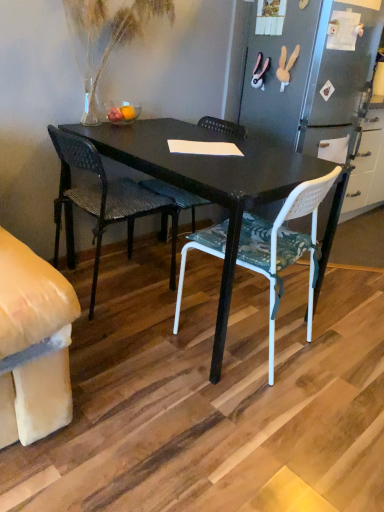
The image size is (384, 512). What do you see at coordinates (285, 246) in the screenshot? I see `white plastic chair at center, placed as the 1th chair when sorted from right to left` at bounding box center [285, 246].

Describe the element at coordinates (105, 200) in the screenshot. Image resolution: width=384 pixels, height=512 pixels. I see `woven dark brown chair at center, which is the second chair in right-to-left order` at that location.

This screenshot has height=512, width=384. I want to click on woven dark brown chair at center, which ranks as the 1th chair in left-to-right order, so click(x=105, y=200).

Locate an element on the screen. The width and height of the screenshot is (384, 512). translucent glass vase at upper left is located at coordinates (106, 36).

Considering the relative positions of woven dark brown chair at center, which is the second chair in right-to-left order, and translucent glass vase at upper left in the image provided, is woven dark brown chair at center, which is the second chair in right-to-left order, to the right of translucent glass vase at upper left from the viewer's perspective?

No, woven dark brown chair at center, which is the second chair in right-to-left order, is not to the right of translucent glass vase at upper left.

Could you tell me if woven dark brown chair at center, which is the second chair in right-to-left order, is facing translucent glass vase at upper left?

No.

Is woven dark brown chair at center, which is the second chair in right-to-left order, with translucent glass vase at upper left?

No, woven dark brown chair at center, which is the second chair in right-to-left order, is not beside translucent glass vase at upper left.

Can you confirm if woven dark brown chair at center, which is the second chair in right-to-left order, is shorter than translucent glass vase at upper left?

No.

Could you tell me if woven dark brown chair at center, which is the second chair in right-to-left order, is turned towards white plastic chair at center, the 2th chair in the left-to-right sequence?

No, woven dark brown chair at center, which is the second chair in right-to-left order, is not facing towards white plastic chair at center, the 2th chair in the left-to-right sequence.

Is woven dark brown chair at center, which is the second chair in right-to-left order, not close to white plastic chair at center, placed as the 1th chair when sorted from right to left?

woven dark brown chair at center, which is the second chair in right-to-left order, is actually quite close to white plastic chair at center, placed as the 1th chair when sorted from right to left.

From a real-world perspective, which is physically above, woven dark brown chair at center, which is the second chair in right-to-left order, or white plastic chair at center, the 2th chair in the left-to-right sequence?

white plastic chair at center, the 2th chair in the left-to-right sequence, is physically above.

Which is more to the left, woven dark brown chair at center, which is the second chair in right-to-left order, or white plastic chair at center, placed as the 1th chair when sorted from right to left?

Positioned to the left is woven dark brown chair at center, which is the second chair in right-to-left order.

Considering the positions of objects translucent glass vase at upper left and woven dark brown chair at center, which is the second chair in right-to-left order, in the image provided, who is more to the left, translucent glass vase at upper left or woven dark brown chair at center, which is the second chair in right-to-left order,?

woven dark brown chair at center, which is the second chair in right-to-left order.

Which object is thinner, translucent glass vase at upper left or woven dark brown chair at center, which is the second chair in right-to-left order?

Thinner between the two is translucent glass vase at upper left.

Is point (99, 40) closer to camera compared to point (85, 187)?

Yes, point (99, 40) is closer to viewer.

Is woven dark brown chair at center, which is the second chair in right-to-left order, located within translucent glass vase at upper left?

No, woven dark brown chair at center, which is the second chair in right-to-left order, is not a part of translucent glass vase at upper left.

From the image's perspective, is white plastic chair at center, the 2th chair in the left-to-right sequence, below translucent glass vase at upper left?

Correct, white plastic chair at center, the 2th chair in the left-to-right sequence, appears lower than translucent glass vase at upper left in the image.

Considering the sizes of objects white plastic chair at center, placed as the 1th chair when sorted from right to left, and translucent glass vase at upper left in the image provided, who is taller, white plastic chair at center, placed as the 1th chair when sorted from right to left, or translucent glass vase at upper left?

With more height is white plastic chair at center, placed as the 1th chair when sorted from right to left.

Are white plastic chair at center, the 2th chair in the left-to-right sequence, and translucent glass vase at upper left located far from each other?

Yes.

Consider the image. Does white plastic chair at center, placed as the 1th chair when sorted from right to left, have a larger size compared to translucent glass vase at upper left?

Indeed, white plastic chair at center, placed as the 1th chair when sorted from right to left, has a larger size compared to translucent glass vase at upper left.

Is the depth of white plastic chair at center, the 2th chair in the left-to-right sequence, less than that of woven dark brown chair at center, which is the second chair in right-to-left order?

Yes, it is in front of woven dark brown chair at center, which is the second chair in right-to-left order.

Is white plastic chair at center, placed as the 1th chair when sorted from right to left, taller or shorter than woven dark brown chair at center, which ranks as the 1th chair in left-to-right order?

Clearly, white plastic chair at center, placed as the 1th chair when sorted from right to left, is shorter compared to woven dark brown chair at center, which ranks as the 1th chair in left-to-right order.

Is white plastic chair at center, placed as the 1th chair when sorted from right to left, not inside woven dark brown chair at center, which ranks as the 1th chair in left-to-right order?

white plastic chair at center, placed as the 1th chair when sorted from right to left, lies outside woven dark brown chair at center, which ranks as the 1th chair in left-to-right order,'s area.

How many degrees apart are the facing directions of white plastic chair at center, placed as the 1th chair when sorted from right to left, and woven dark brown chair at center, which ranks as the 1th chair in left-to-right order?

The facing directions of white plastic chair at center, placed as the 1th chair when sorted from right to left, and woven dark brown chair at center, which ranks as the 1th chair in left-to-right order, are 106 degrees apart.

Based on the photo, is translucent glass vase at upper left completely or partially outside of white plastic chair at center, placed as the 1th chair when sorted from right to left?

Indeed, translucent glass vase at upper left is completely outside white plastic chair at center, placed as the 1th chair when sorted from right to left.

Considering the relative sizes of translucent glass vase at upper left and white plastic chair at center, placed as the 1th chair when sorted from right to left, in the image provided, is translucent glass vase at upper left smaller than white plastic chair at center, placed as the 1th chair when sorted from right to left,?

Yes.

Which point is more forward, (x=151, y=13) or (x=245, y=241)?

The point (x=245, y=241) is more forward.

The image size is (384, 512). Find the location of `houseplant in front of the woven dark brown chair at center, which is the second chair in right-to-left order`. houseplant in front of the woven dark brown chair at center, which is the second chair in right-to-left order is located at coordinates point(106,36).

What are the coordinates of `chair lying below the woven dark brown chair at center, which is the second chair in right-to-left order (from the image's perspective)` in the screenshot? It's located at [285, 246].

Based on their spatial positions, is white plastic chair at center, placed as the 1th chair when sorted from right to left, or woven dark brown chair at center, which is the second chair in right-to-left order, further from translucent glass vase at upper left?

white plastic chair at center, placed as the 1th chair when sorted from right to left, lies further to translucent glass vase at upper left than the other object.

Which object lies nearer to the anchor point white plastic chair at center, placed as the 1th chair when sorted from right to left, woven dark brown chair at center, which ranks as the 1th chair in left-to-right order, or translucent glass vase at upper left?

woven dark brown chair at center, which ranks as the 1th chair in left-to-right order, is positioned closer to the anchor white plastic chair at center, placed as the 1th chair when sorted from right to left.

Looking at the image, which one is located further to woven dark brown chair at center, which is the second chair in right-to-left order, translucent glass vase at upper left or white plastic chair at center, the 2th chair in the left-to-right sequence?

white plastic chair at center, the 2th chair in the left-to-right sequence.

Considering their positions, is white plastic chair at center, placed as the 1th chair when sorted from right to left, positioned further to woven dark brown chair at center, which is the second chair in right-to-left order, than translucent glass vase at upper left?

The object further to woven dark brown chair at center, which is the second chair in right-to-left order, is white plastic chair at center, placed as the 1th chair when sorted from right to left.

Looking at the image, which one is located further to white plastic chair at center, the 2th chair in the left-to-right sequence, translucent glass vase at upper left or woven dark brown chair at center, which is the second chair in right-to-left order?

translucent glass vase at upper left.

Estimate the real-world distances between objects in this image. Which object is closer to translucent glass vase at upper left, woven dark brown chair at center, which is the second chair in right-to-left order, or white plastic chair at center, the 2th chair in the left-to-right sequence?

woven dark brown chair at center, which is the second chair in right-to-left order, is positioned closer to the anchor translucent glass vase at upper left.

At what (x,y) coordinates should I click in order to perform the action: click on chair that lies between translucent glass vase at upper left and white plastic chair at center, the 2th chair in the left-to-right sequence, from top to bottom. Please return your answer as a coordinate pair (x, y). Image resolution: width=384 pixels, height=512 pixels. Looking at the image, I should click on (105, 200).